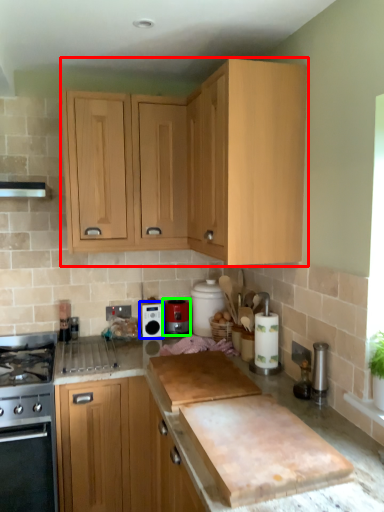
Question: Estimate the real-world distances between objects in this image. Which object is farther from cabinetry (highlighted by a red box), kitchen appliance (highlighted by a blue box) or kitchen appliance (highlighted by a green box)?

Choices:
 (A) kitchen appliance
 (B) kitchen appliance

Answer: (B)